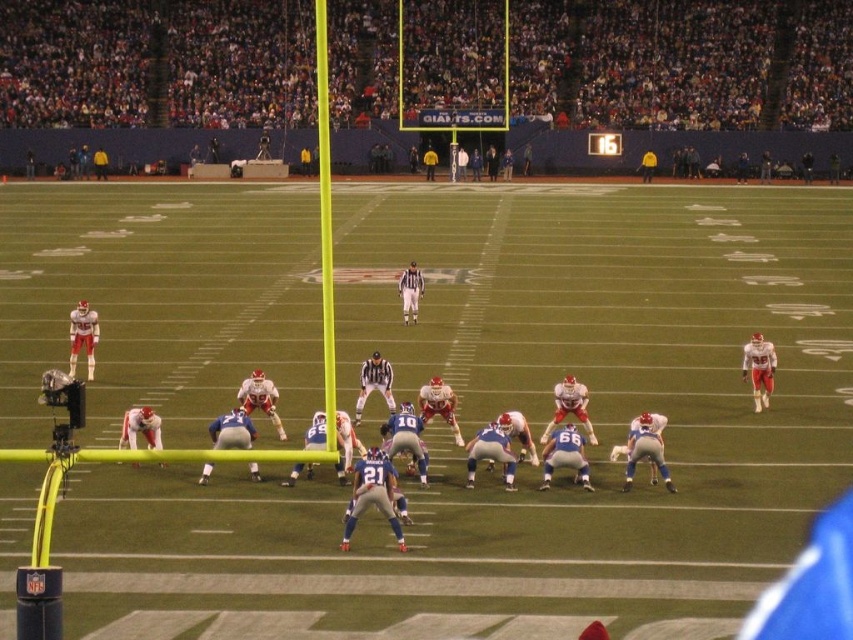
Can you confirm if matte white helmet at right is positioned to the right of white striped referee at center?

Correct, you'll find matte white helmet at right to the right of white striped referee at center.

Does point (764, 346) come closer to viewer compared to point (399, 296)?

That is True.

Identify the location of matte white helmet at right. The height and width of the screenshot is (640, 853). (759, 369).